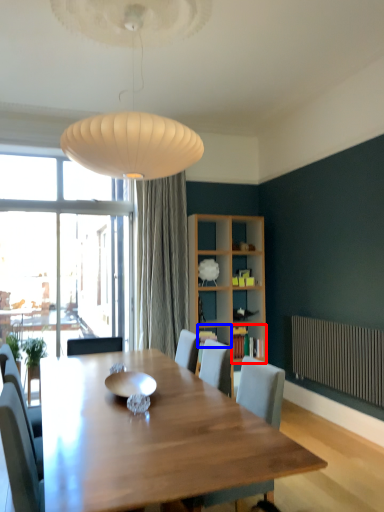
Question: Among these objects, which one is farthest to the camera, shelf (highlighted by a red box) or shelf (highlighted by a blue box)?

Choices:
 (A) shelf
 (B) shelf

Answer: (A)